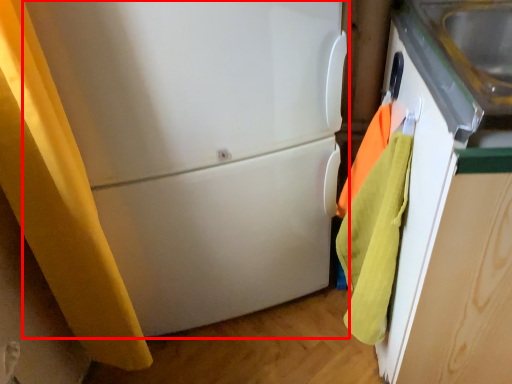
Question: From the image's perspective, where is refrigerator (annotated by the red box) located relative to beach towel?

Choices:
 (A) below
 (B) above

Answer: (B)